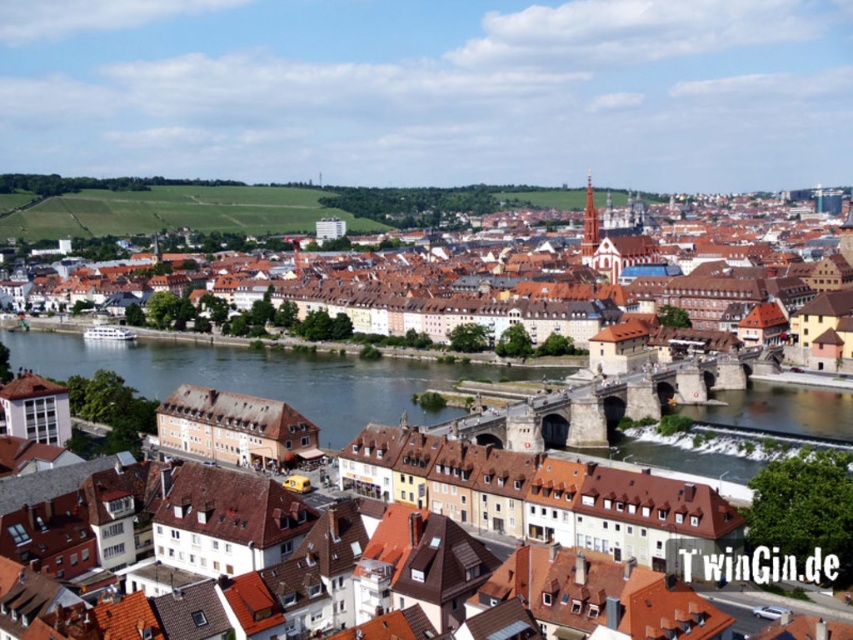
Question: Is brown/wooden townhouses at center smaller than blue water at center?

Choices:
 (A) no
 (B) yes

Answer: (A)

Question: Which object is farther from the camera taking this photo?

Choices:
 (A) brown/wooden townhouses at center
 (B) smooth concrete river at center
 (C) blue water at center

Answer: (A)

Question: Is brown/wooden townhouses at center positioned behind blue water at center?

Choices:
 (A) yes
 (B) no

Answer: (A)

Question: Which of these objects is positioned closest to the blue water at center?

Choices:
 (A) brown/wooden townhouses at center
 (B) smooth concrete river at center

Answer: (B)

Question: Is brown/wooden townhouses at center thinner than blue water at center?

Choices:
 (A) yes
 (B) no

Answer: (B)

Question: Based on their relative distances, which object is farther from the brown/wooden townhouses at center?

Choices:
 (A) smooth concrete river at center
 (B) blue water at center

Answer: (B)